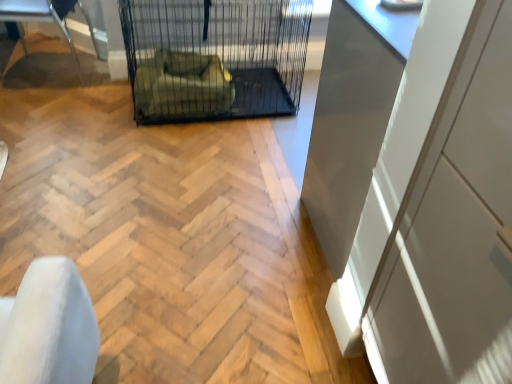
You are a GUI agent. You are given a task and a screenshot of the screen. Output one action in this format:
    pyautogui.click(x=<x>, y=<y>)
    Task: Click on the free space in front of green fabric armchair at center
    
    Given the screenshot: What is the action you would take?
    pyautogui.click(x=169, y=148)